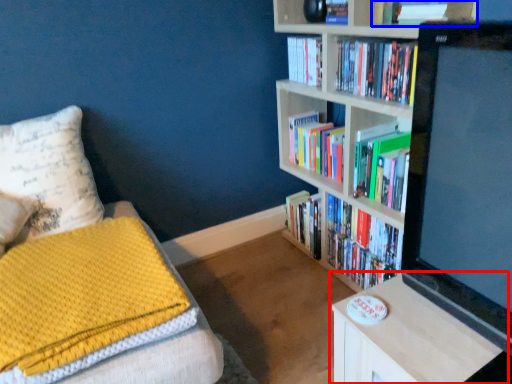
Question: Which point is further to the camera, table (highlighted by a red box) or book (highlighted by a blue box)?

Choices:
 (A) table
 (B) book

Answer: (B)